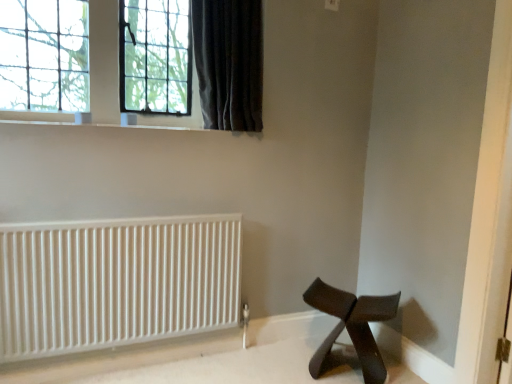
Question: From the image's perspective, is clear glass window at upper left above dark velvet curtain at upper left?

Choices:
 (A) yes
 (B) no

Answer: (A)

Question: Does clear glass window at upper left come in front of dark velvet curtain at upper left?

Choices:
 (A) yes
 (B) no

Answer: (B)

Question: From a real-world perspective, is clear glass window at upper left on top of dark velvet curtain at upper left?

Choices:
 (A) no
 (B) yes

Answer: (A)

Question: Is clear glass window at upper left thinner than dark velvet curtain at upper left?

Choices:
 (A) yes
 (B) no

Answer: (A)

Question: Is clear glass window at upper left at the left side of dark velvet curtain at upper left?

Choices:
 (A) no
 (B) yes

Answer: (B)

Question: Considering the relative sizes of clear glass window at upper left and dark velvet curtain at upper left in the image provided, is clear glass window at upper left taller than dark velvet curtain at upper left?

Choices:
 (A) no
 (B) yes

Answer: (A)

Question: From the image's perspective, is white matte radiator at lower left located beneath black matte stool at lower right?

Choices:
 (A) yes
 (B) no

Answer: (B)

Question: Is white matte radiator at lower left positioned with its back to black matte stool at lower right?

Choices:
 (A) yes
 (B) no

Answer: (B)

Question: Does white matte radiator at lower left have a greater width compared to black matte stool at lower right?

Choices:
 (A) no
 (B) yes

Answer: (A)

Question: Is white matte radiator at lower left to the right of black matte stool at lower right from the viewer's perspective?

Choices:
 (A) yes
 (B) no

Answer: (B)

Question: Is black matte stool at lower right completely or partially inside white matte radiator at lower left?

Choices:
 (A) no
 (B) yes

Answer: (A)

Question: Can you confirm if white matte radiator at lower left is taller than black matte stool at lower right?

Choices:
 (A) yes
 (B) no

Answer: (A)

Question: Does clear glass window at upper left turn towards black matte stool at lower right?

Choices:
 (A) no
 (B) yes

Answer: (A)